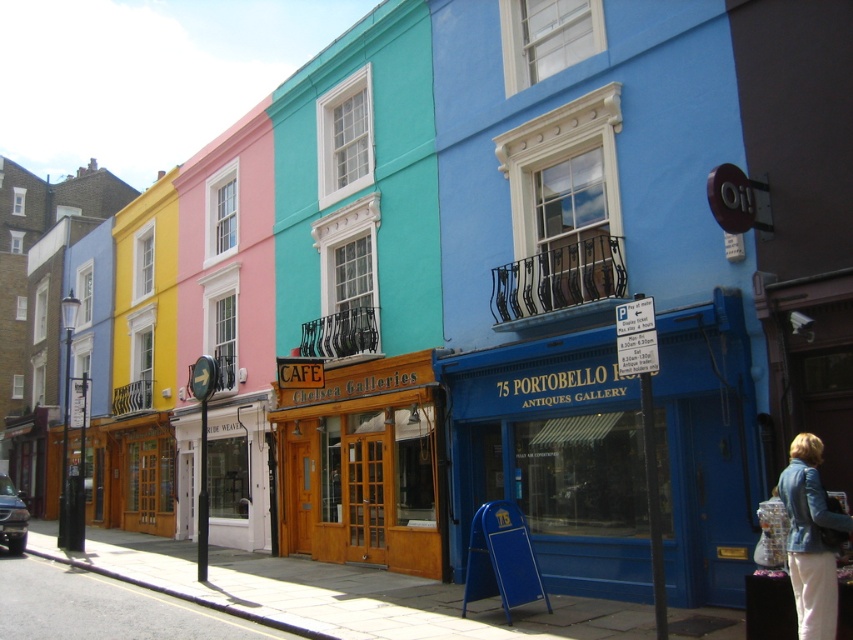
You are a delivery person who needs to place a large package on top of the blue matte building at center. However, there is a wooden door at center in the way. Can you place the package on the building without moving the door?

The blue matte building at center is shorter than the wooden door at center. Since the door is taller, it would block access to the building roof, making it impossible to place the package there without moving the door.

You are standing at the entrance of the 75 Portobello Antiques Gallery. Where is the wooden door at center located in relation to your current position?

The wooden door at center is located at point (364, 465).

You are standing at the origin point of the coordinate system. Which direction should you move to reach the blue matte building at center?

The blue matte building at center is located at coordinate point (555, 456), so you should move towards the positive x and y directions to reach it.